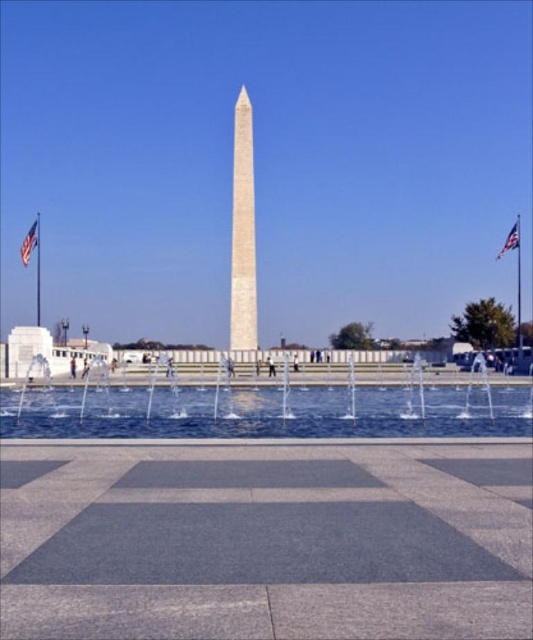
You are standing at the base of the Washington Monument and notice the clear water at center and the red fabric flag at upper left. Which object has a smaller width?

The clear water at center has a smaller width than the red fabric flag at upper left.

You are a tourist standing in front of the Washington Monument. You see the clear water at center and the american flag at upper right. Which object is closer to you?

The clear water at center is closer to you because it is in front of the american flag at upper right.

You are standing on the paved area in front of the Washington Monument and want to place a small flag holder exactly where the american flag at upper right is reflected in the clear water at center. Is this possible?

The clear water at center is positioned under the american flag at upper right, so the reflection of the flag would appear in the water. Therefore, placing the flag holder at that reflection point is possible.